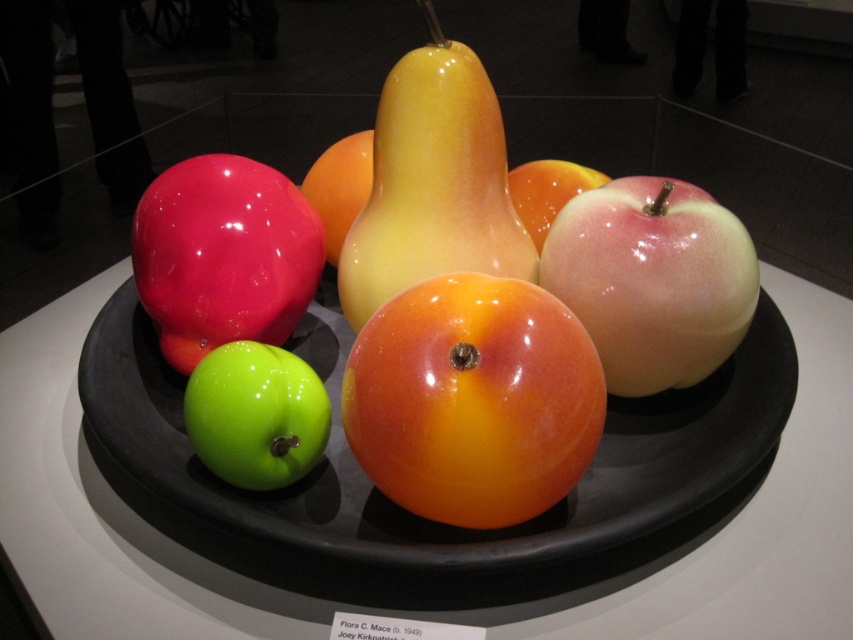
Question: Observing the image, what is the correct spatial positioning of glossy ceramic apple at upper right in reference to glossy apple at center?

Choices:
 (A) above
 (B) below

Answer: (B)

Question: Can you confirm if glossy ceramic apple at upper right is positioned to the left of green glossy apple at lower left?

Choices:
 (A) yes
 (B) no

Answer: (B)

Question: Which object is farther from the camera taking this photo?

Choices:
 (A) glossy ceramic platter at center
 (B) green glossy apple at lower left
 (C) glossy ceramic apple at upper right
 (D) glossy orange apple at center

Answer: (B)

Question: Which object appears farthest from the camera in this image?

Choices:
 (A) glossy yellow pear at center
 (B) glossy plastic apple at lower left

Answer: (B)

Question: From the image, what is the correct spatial relationship of glossy orange apple at center in relation to glossy ceramic apple at upper right?

Choices:
 (A) left
 (B) right

Answer: (A)

Question: Which object appears farthest from the camera in this image?

Choices:
 (A) glossy ceramic apple at upper right
 (B) glossy ceramic platter at center

Answer: (A)